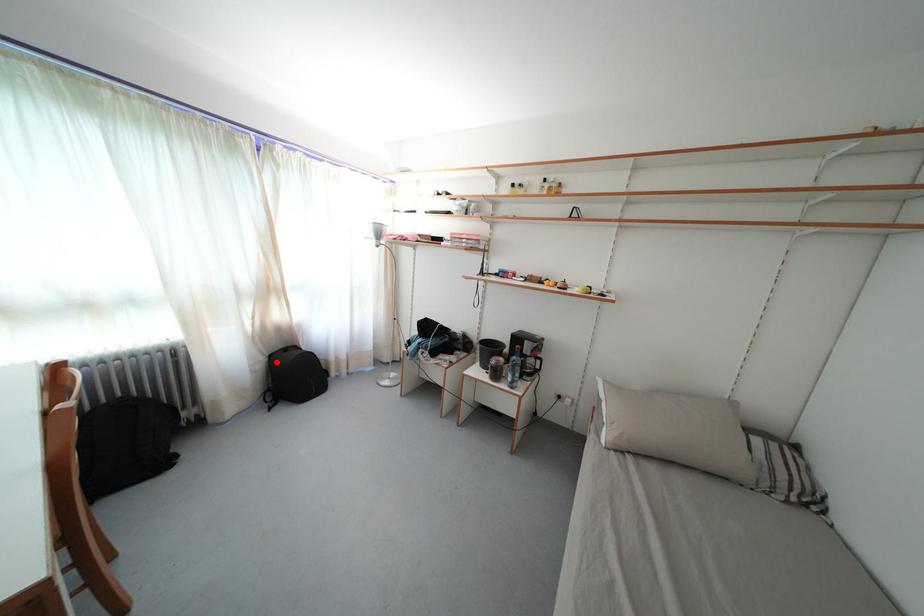
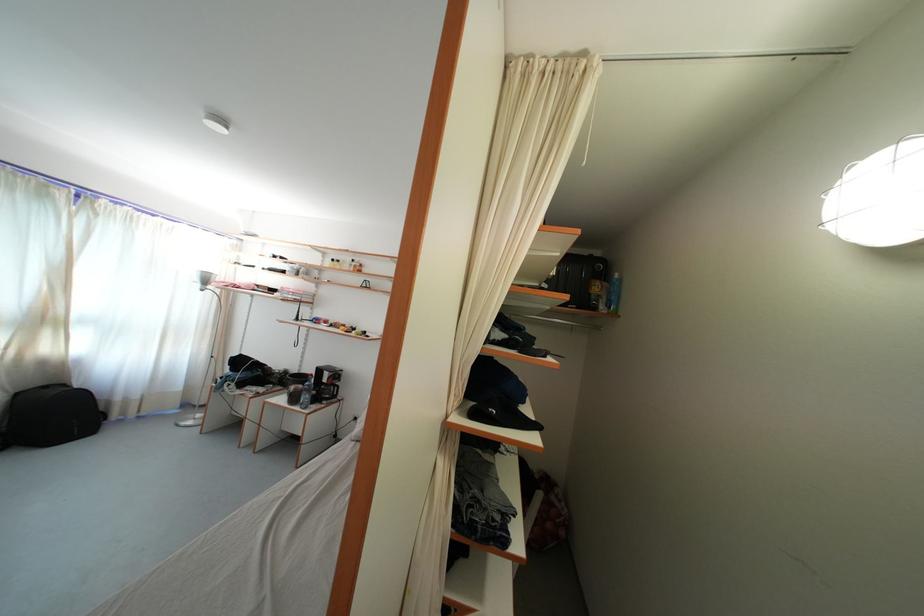
Question: I am providing you with two images of the same scene from different viewpoints. A red point is shown in image1. For the corresponding object point in image2, is it positioned nearer or farther from the camera?

Choices:
 (A) Nearer
 (B) Farther

Answer: (B)